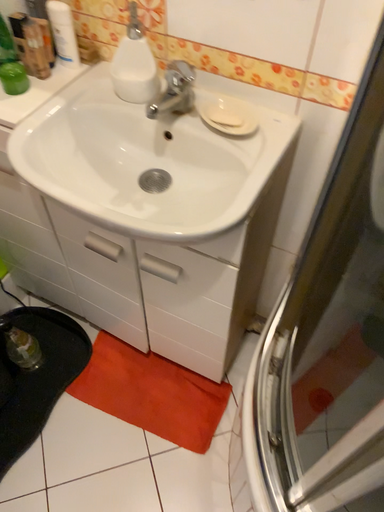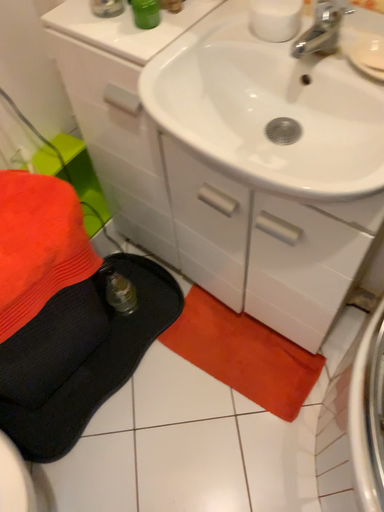
Question: Which way did the camera rotate in the video?

Choices:
 (A) rotated left
 (B) rotated right

Answer: (A)